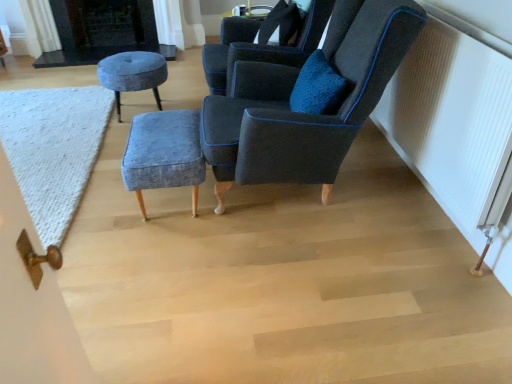
This screenshot has height=384, width=512. I want to click on free region under velvet dark blue chair at upper right, which is counted as the first chair, starting from the front (from a real-world perspective), so click(290, 199).